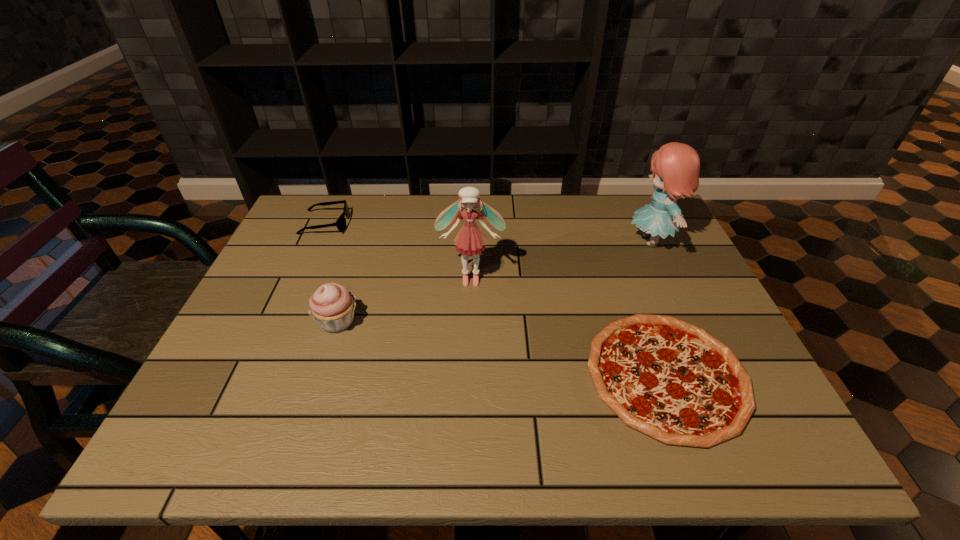
I want to click on the right doll, so click(675, 166).

Find the location of a particular element. the left doll is located at coordinates pos(470,240).

Image resolution: width=960 pixels, height=540 pixels. I want to click on cupcake, so (332, 306).

The width and height of the screenshot is (960, 540). Identify the location of the second object from left to right. (332, 306).

Find the location of a particular element. sunglasses is located at coordinates (341, 221).

At what (x,y) coordinates should I click in order to perform the action: click on the second shortest object. Please return your answer as a coordinate pair (x, y). This screenshot has height=540, width=960. Looking at the image, I should click on (341, 221).

Identify the location of pizza. Image resolution: width=960 pixels, height=540 pixels. (671, 380).

I want to click on vacant space located 0.300m on the front-facing side of the right doll, so click(522, 241).

The image size is (960, 540). What are the coordinates of `free space located 0.100m on the front-facing side of the right doll` in the screenshot? It's located at (591, 241).

Where is `blank space located 0.130m on the front-facing side of the right doll`? This screenshot has width=960, height=540. blank space located 0.130m on the front-facing side of the right doll is located at coordinates tap(581, 241).